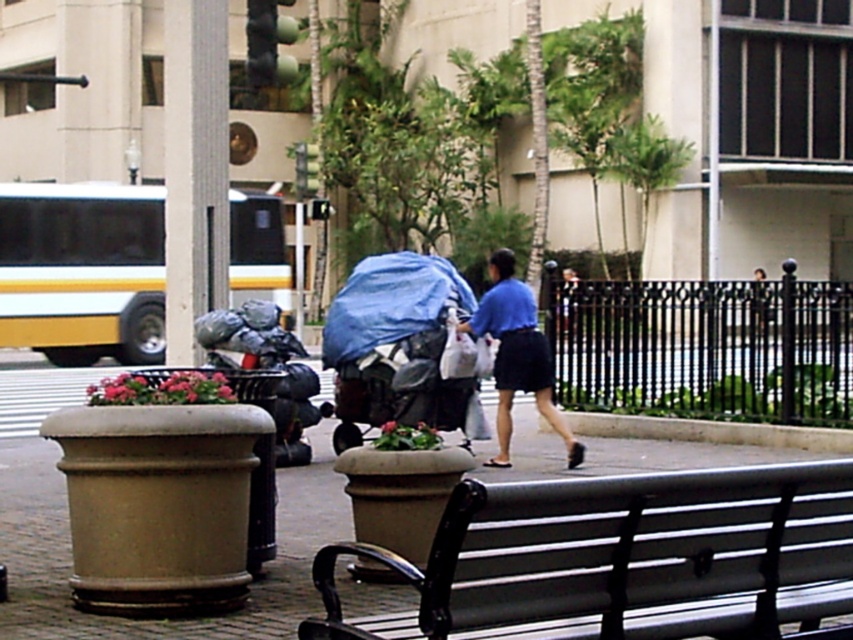
Between metallic gray bench at lower center and blue cotton shirt at center, which one appears on the left side from the viewer's perspective?

blue cotton shirt at center is more to the left.

Does point (547, 637) come behind point (506, 348)?

No, (547, 637) is in front of (506, 348).

The image size is (853, 640). In order to click on metallic gray bench at lower center in this screenshot , I will do `click(624, 560)`.

Is metallic gray bench at lower center closer to camera compared to smooth concrete pavement at center?

Yes, it is in front of smooth concrete pavement at center.

The height and width of the screenshot is (640, 853). In order to click on metallic gray bench at lower center in this screenshot , I will do `click(624, 560)`.

Locate an element on the screen. metallic gray bench at lower center is located at coordinates (624, 560).

Between point (293, 556) and point (511, 328), which one is positioned behind?

Positioned behind is point (511, 328).

Which of these two, smooth concrete pavement at center or blue cotton shirt at center, stands taller?

blue cotton shirt at center

Which is behind, point (55, 534) or point (548, 378)?

The point (548, 378) is more distant.

Find the location of `smooth concrete pavement at center`. smooth concrete pavement at center is located at coordinates (68, 532).